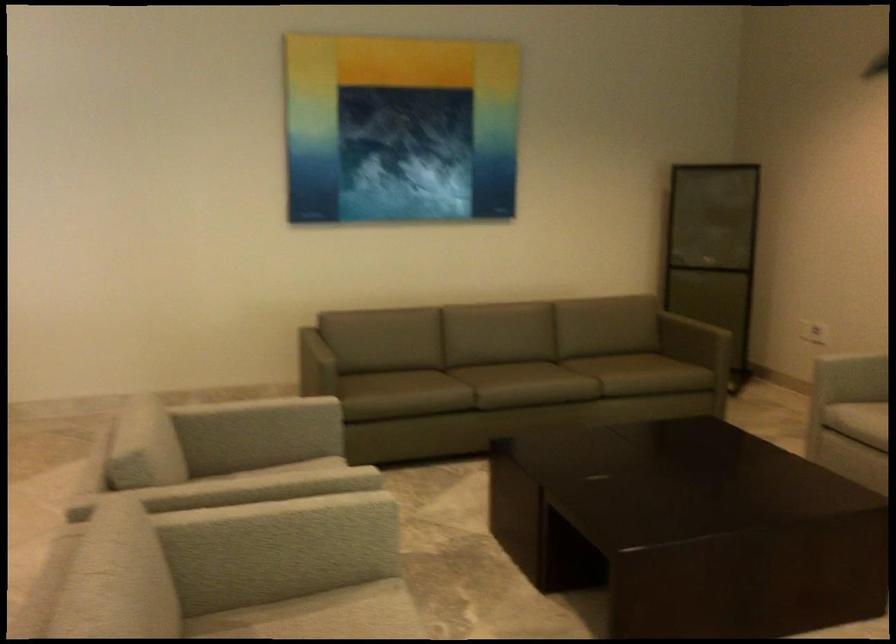
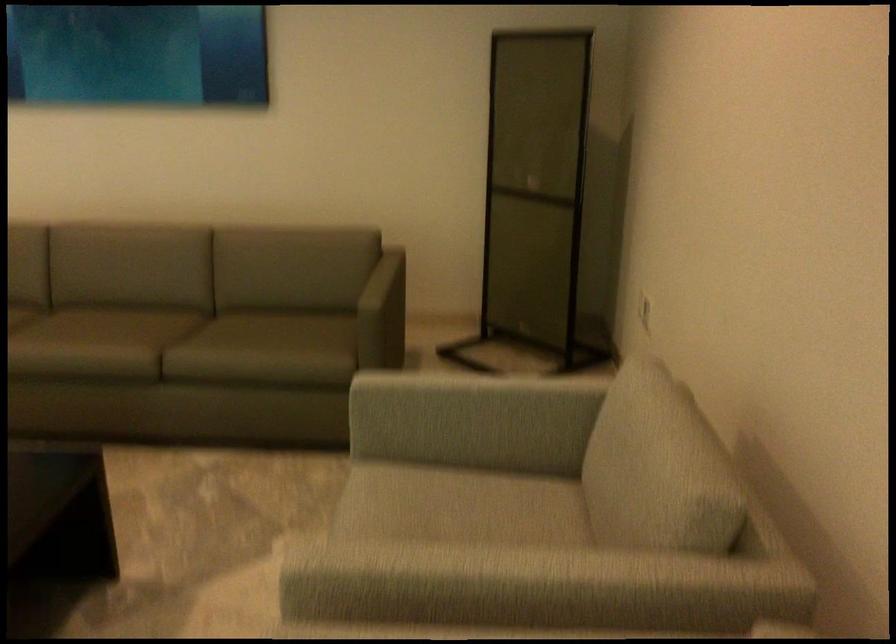
The point at (705, 263) is marked in the first image. Where is the corresponding point in the second image?

(536, 194)